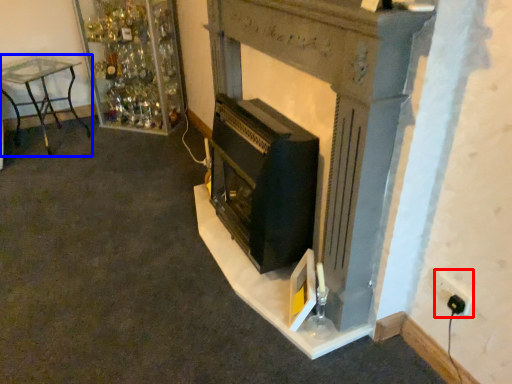
Question: Among these objects, which one is farthest to the camera, electric outlet (highlighted by a red box) or furniture (highlighted by a blue box)?

Choices:
 (A) electric outlet
 (B) furniture

Answer: (B)